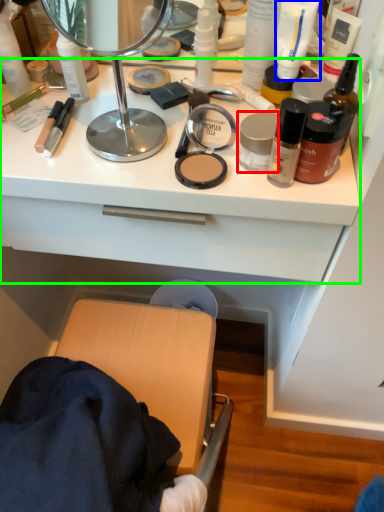
Question: Considering the real-world distances, which object is closest to toiletry (highlighted by a red box)? toiletry (highlighted by a blue box) or counter top (highlighted by a green box).

Choices:
 (A) toiletry
 (B) counter top

Answer: (A)